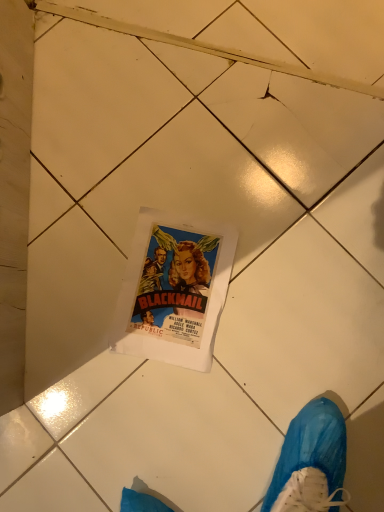
Image resolution: width=384 pixels, height=512 pixels. Find the location of `free space above matte paper poster at center (from a real-world perspective)`. free space above matte paper poster at center (from a real-world perspective) is located at coordinates (174, 289).